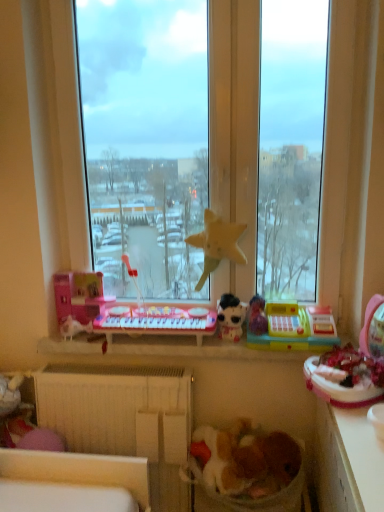
Question: Does fluffy fabric laundry basket at lower center have a smaller size compared to white glossy counter top at lower right?

Choices:
 (A) no
 (B) yes

Answer: (B)

Question: From a real-world perspective, is fluffy fabric laundry basket at lower center on top of white glossy counter top at lower right?

Choices:
 (A) yes
 (B) no

Answer: (B)

Question: Would you say fluffy fabric laundry basket at lower center is a long distance from white glossy counter top at lower right?

Choices:
 (A) yes
 (B) no

Answer: (B)

Question: Is fluffy fabric laundry basket at lower center beside white glossy counter top at lower right?

Choices:
 (A) yes
 (B) no

Answer: (B)

Question: Considering the relative sizes of fluffy fabric laundry basket at lower center and white glossy counter top at lower right in the image provided, is fluffy fabric laundry basket at lower center bigger than white glossy counter top at lower right?

Choices:
 (A) no
 (B) yes

Answer: (A)

Question: From a real-world perspective, is yellow plastic cash register at center, arranged as the fourth toy when viewed from the left, above or below yellow fabric star at center, acting as the second toy starting from the left?

Choices:
 (A) above
 (B) below

Answer: (B)

Question: Is yellow plastic cash register at center, the first toy from the right, taller or shorter than yellow fabric star at center, acting as the second toy starting from the left?

Choices:
 (A) short
 (B) tall

Answer: (A)

Question: Visually, is yellow plastic cash register at center, the first toy from the right, positioned to the left or to the right of yellow fabric star at center, acting as the second toy starting from the left?

Choices:
 (A) left
 (B) right

Answer: (B)

Question: Is point (317, 309) positioned closer to the camera than point (236, 224)?

Choices:
 (A) farther
 (B) closer

Answer: (A)

Question: Considering the positions of white matte radiator at lower center and fluffy fabric laundry basket at lower center in the image, is white matte radiator at lower center taller or shorter than fluffy fabric laundry basket at lower center?

Choices:
 (A) tall
 (B) short

Answer: (A)

Question: Is white matte radiator at lower center wider or thinner than fluffy fabric laundry basket at lower center?

Choices:
 (A) thin
 (B) wide

Answer: (A)

Question: In the image, is white matte radiator at lower center positioned in front of or behind fluffy fabric laundry basket at lower center?

Choices:
 (A) behind
 (B) front

Answer: (A)

Question: Is point (132, 376) closer or farther from the camera than point (248, 459)?

Choices:
 (A) closer
 (B) farther

Answer: (B)

Question: Considering the positions of white glossy counter top at lower right and transparent glass window at center in the image, is white glossy counter top at lower right taller or shorter than transparent glass window at center?

Choices:
 (A) short
 (B) tall

Answer: (A)

Question: Relative to transparent glass window at center, is white glossy counter top at lower right in front or behind?

Choices:
 (A) front
 (B) behind

Answer: (A)